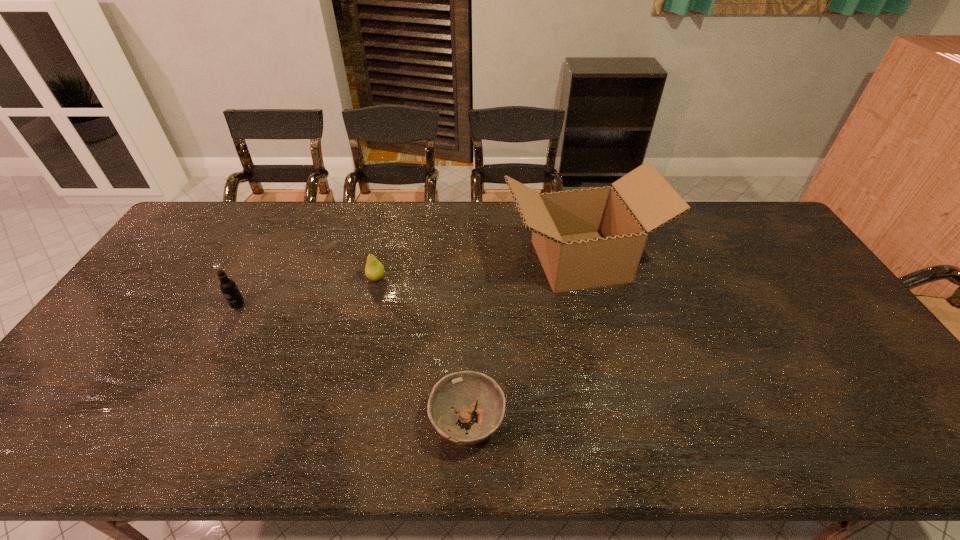
The height and width of the screenshot is (540, 960). What are the coordinates of `free space located 0.210m on the right of the pear` in the screenshot? It's located at (454, 279).

You are a GUI agent. You are given a task and a screenshot of the screen. Output one action in this format:
    pyautogui.click(x=<x>, y=<y>)
    Task: Click on the blank space located 0.320m on the back of the second object from right to left
    The height and width of the screenshot is (540, 960).
    Given the screenshot: What is the action you would take?
    pyautogui.click(x=470, y=295)

The image size is (960, 540). What are the coordinates of `object present at the far edge` in the screenshot? It's located at (587, 238).

Locate an element on the screen. object that is at the near edge is located at coordinates (463, 390).

Where is `vacant space at the far edge`? Image resolution: width=960 pixels, height=540 pixels. vacant space at the far edge is located at coordinates (336, 235).

This screenshot has width=960, height=540. What are the coordinates of `free region at the right edge` in the screenshot? It's located at (764, 256).

In the image, there is a desktop. Where is `vacant space at the far right corner`? Image resolution: width=960 pixels, height=540 pixels. vacant space at the far right corner is located at coordinates (762, 231).

The width and height of the screenshot is (960, 540). I want to click on free space between the second tallest object and the shortest object, so click(x=353, y=364).

You are a GUI agent. You are given a task and a screenshot of the screen. Output one action in this format:
    pyautogui.click(x=<x>, y=<y>)
    Task: Click on the free spot between the box and the second shortest object
    The image size is (960, 540).
    Given the screenshot: What is the action you would take?
    pyautogui.click(x=478, y=269)

I want to click on unoccupied position between the pear and the leftmost object, so click(x=307, y=292).